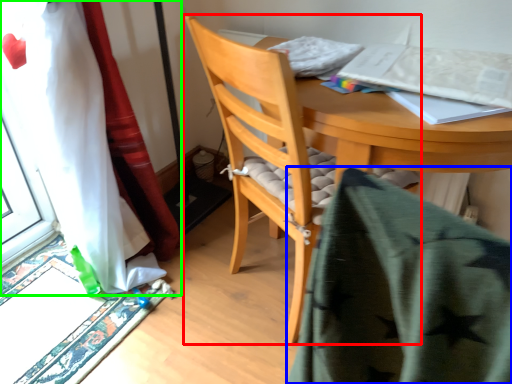
Question: Which object is the closest to the chair (highlighted by a red box)? Choose among these: blanket (highlighted by a blue box) or curtain (highlighted by a green box).

Choices:
 (A) blanket
 (B) curtain

Answer: (B)